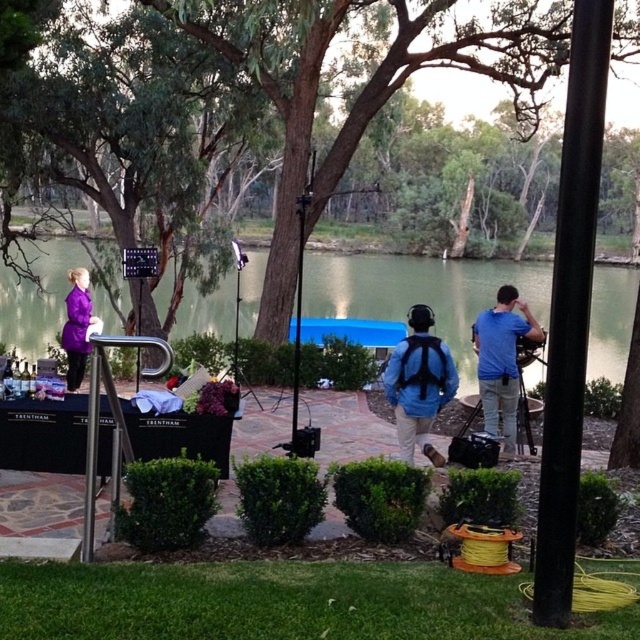
You are organizing a picnic and need to pack your items. You have a blue matte backpack at center and a matte purple coat at left. Which item has a larger width to accommodate more items?

The blue matte backpack at center has a larger width than the matte purple coat at left, so it can accommodate more items.

You are standing at the black table with the word TRENTHAM and want to move towards the two people walking away from you. Which point, point (x=289, y=292) or point (x=429, y=424), is closer to you as you move towards them?

Point (x=289, y=292) is closer to you than point (x=429, y=424) because it is further to the viewer, meaning it is nearer in the scene.

You are a photographer trying to capture the entire scene in one shot. Given that the green water at center and the blue fabric shirt at center are both in the frame, which object takes up more space in the photo?

The green water at center takes up more space in the photo because it is bigger than the blue fabric shirt at center.